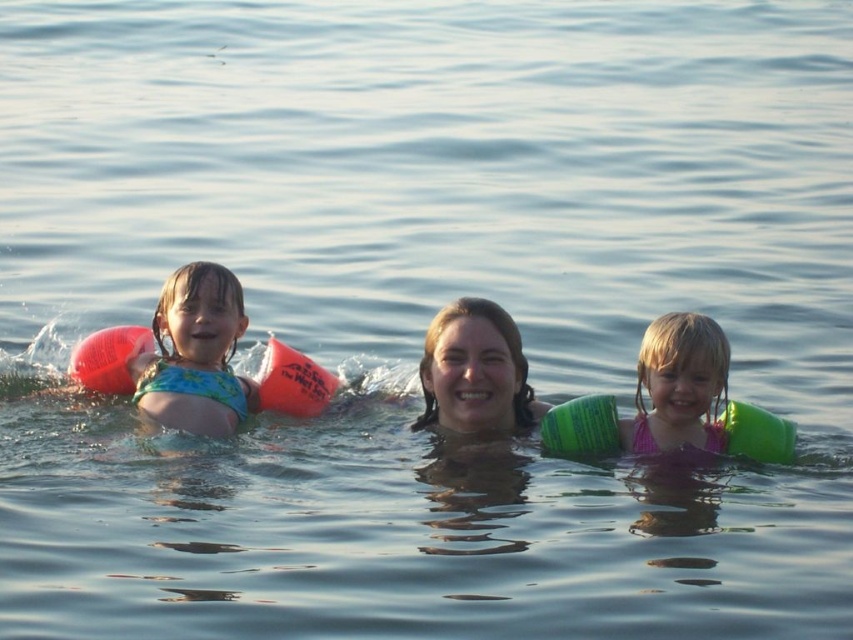
Who is more forward, [178,316] or [462,376]?

Point [462,376] is in front.

From the picture: Can you confirm if blue-green swimsuit at left is thinner than green rubber arm float at center?

Indeed, blue-green swimsuit at left has a lesser width compared to green rubber arm float at center.

This screenshot has width=853, height=640. In order to click on blue-green swimsuit at left in this screenshot , I will do `click(195, 353)`.

The image size is (853, 640). What are the coordinates of `blue-green swimsuit at left` in the screenshot? It's located at (195, 353).

Between point (201, 356) and point (642, 342), which one is positioned behind?

Point (201, 356)

Between blue-green swimsuit at left and pink fabric swimsuit at center, which one appears on the right side from the viewer's perspective?

From the viewer's perspective, pink fabric swimsuit at center appears more on the right side.

Describe the element at coordinates (195, 353) in the screenshot. This screenshot has width=853, height=640. I see `blue-green swimsuit at left` at that location.

What are the coordinates of `blue-green swimsuit at left` in the screenshot? It's located at (195, 353).

Does green rubber arm float at center have a smaller size compared to pink fabric swimsuit at center?

No.

This screenshot has width=853, height=640. Describe the element at coordinates (474, 371) in the screenshot. I see `green rubber arm float at center` at that location.

Where is `green rubber arm float at center`? green rubber arm float at center is located at coordinates (474, 371).